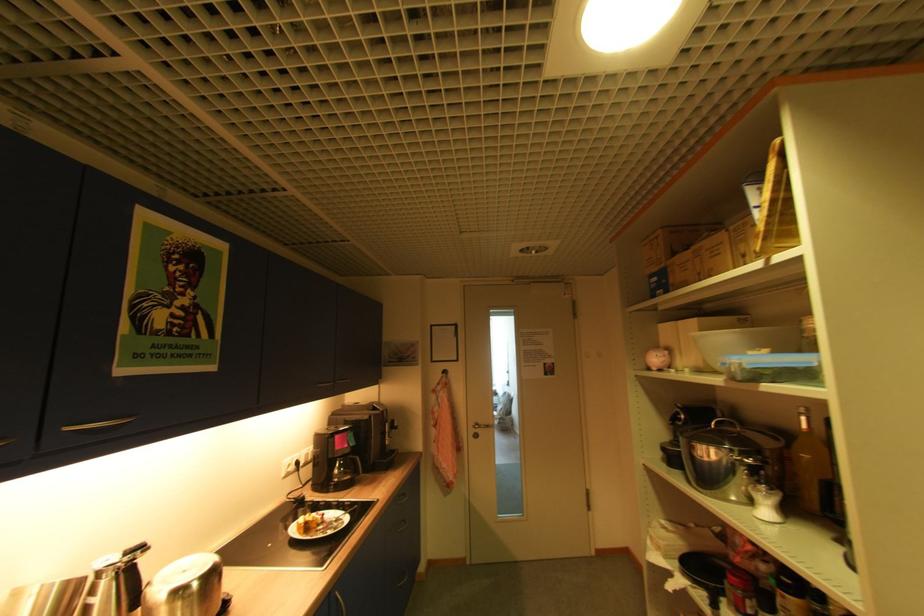
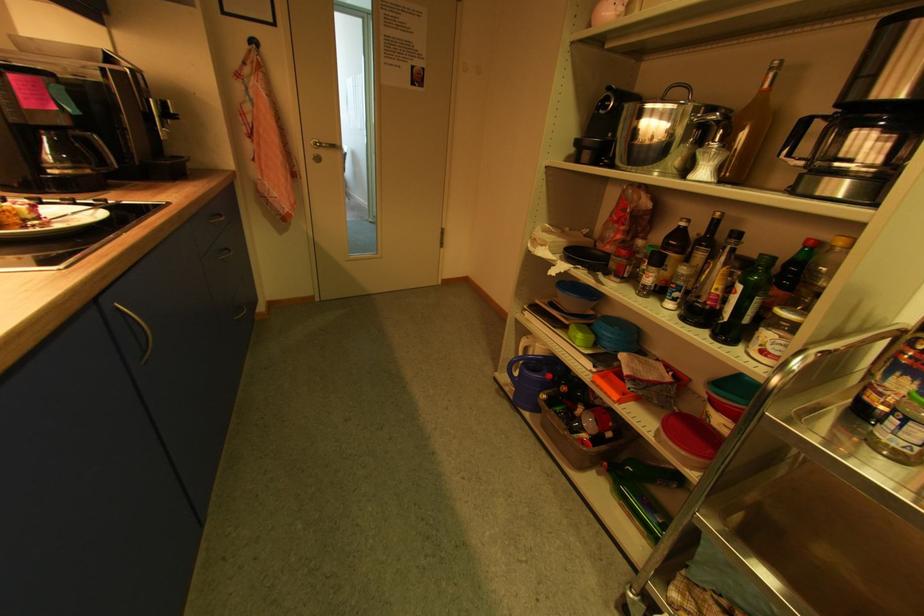
Where in the second image is the point corresponding to pixel 483 426 from the first image?

(323, 146)